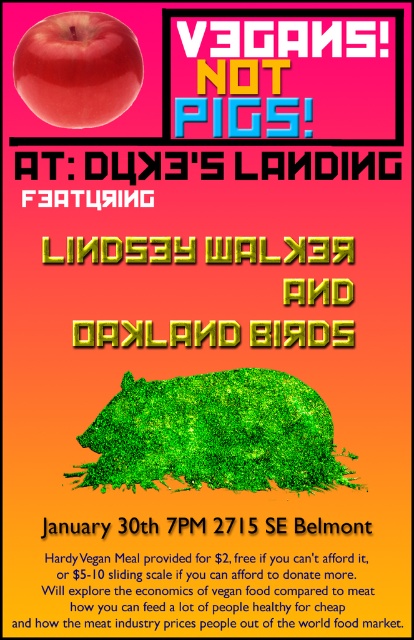
You are an event organizer checking the poster layout. The white paper at upper center and the yellow metallic lindsey walker and oakland birds at center are both important elements. Based on their positions, which one do you think is more visible to viewers?

The white paper at upper center is in front of yellow metallic lindsey walker and oakland birds at center, so it is more visible to viewers.

What is located at the point with coordinates [209,577] on the image?

A white paper is located at point [209,577].

You are designing a poster and need to place a new element between the white paper at upper center and the yellow metallic lindsey walker and oakland birds at center. Considering their sizes, which object should you place the new element closer to?

The white paper at upper center has a larger width than the yellow metallic lindsey walker and oakland birds at center, so the new element should be placed closer to the yellow metallic lindsey walker and oakland birds at center to maintain balance.